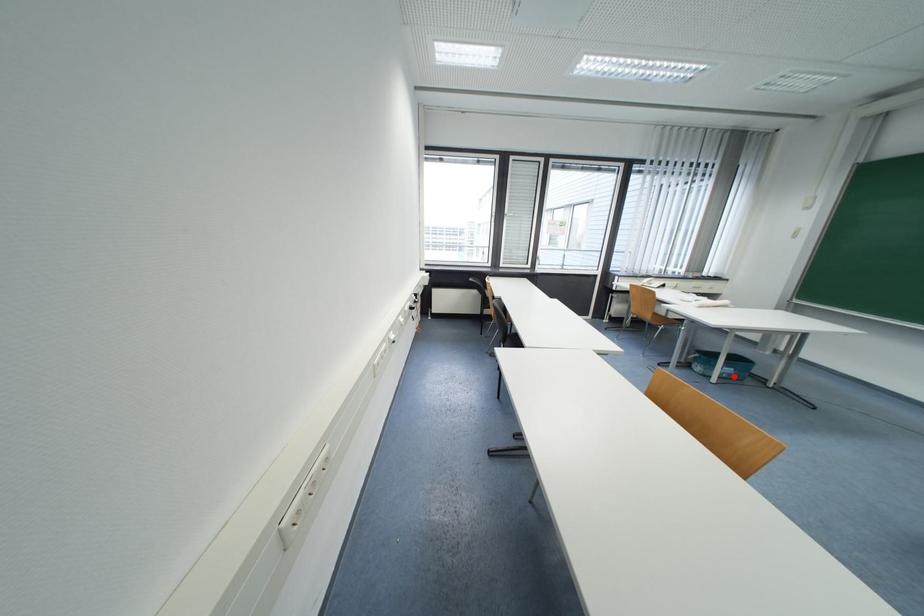
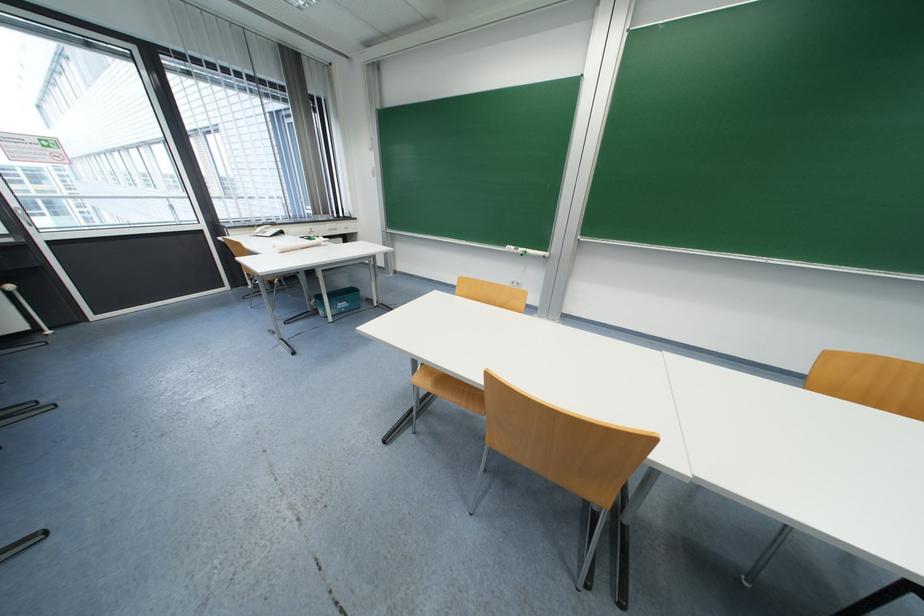
Locate, in the second image, the point that corresponds to the highlighted location in the first image.

(350, 310)